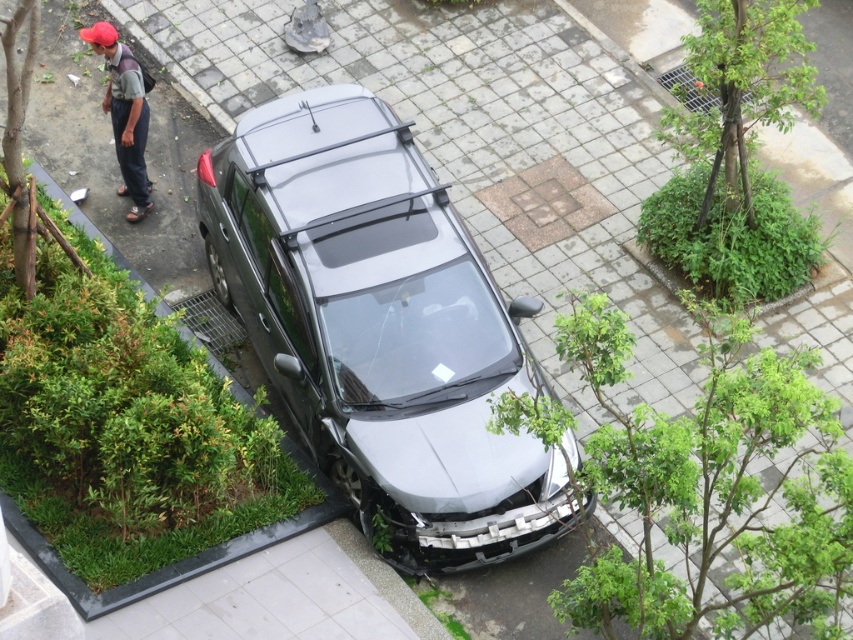
Is satin black car at center above matte red cap at upper left?

Incorrect, satin black car at center is not positioned above matte red cap at upper left.

Can you confirm if satin black car at center is positioned to the right of matte red cap at upper left?

Yes, satin black car at center is to the right of matte red cap at upper left.

From the picture: Who is more forward, (489, 305) or (138, 163)?

Point (489, 305) is in front.

I want to click on satin black car at center, so click(x=380, y=328).